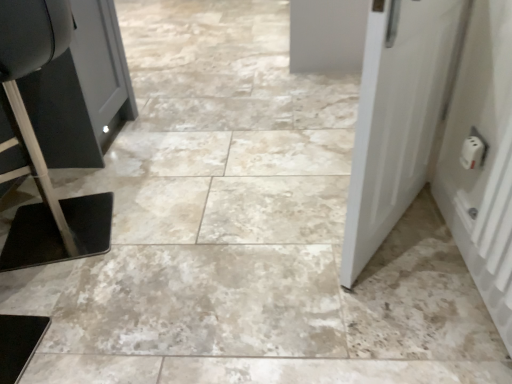
Find the location of a particular element. This screenshot has height=384, width=512. vacant area that is in front of white matte door at right, positioned as the 2th door in right-to-left order is located at coordinates (388, 303).